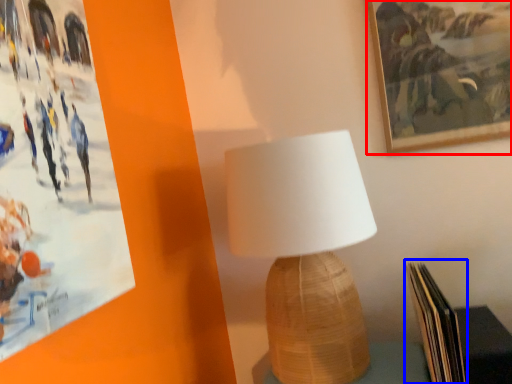
Question: Which of the following is the farthest to the observer, picture frame (highlighted by a red box) or paperback book (highlighted by a blue box)?

Choices:
 (A) picture frame
 (B) paperback book

Answer: (A)